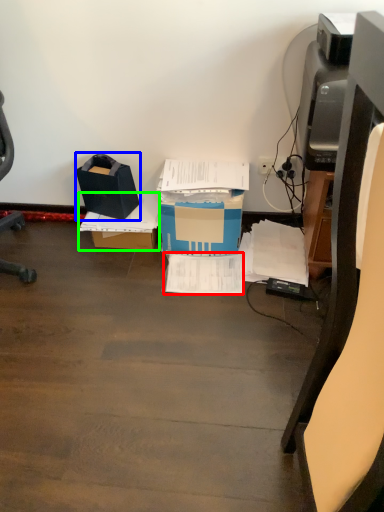
Question: Which object is positioned closest to document (highlighted by a red box)? Select from box (highlighted by a blue box) and cardboard box (highlighted by a green box).

Choices:
 (A) box
 (B) cardboard box

Answer: (B)